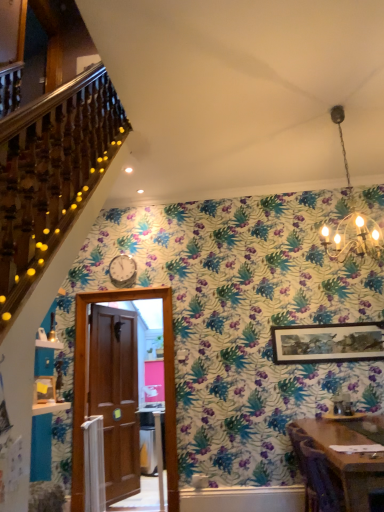
The image size is (384, 512). Describe the element at coordinates (88, 392) in the screenshot. I see `brown wooden door at center` at that location.

Measure the distance between point (341, 473) and camera.

They are 6.80 feet apart.

The height and width of the screenshot is (512, 384). Find the location of `brown wooden door at center`. brown wooden door at center is located at coordinates (88, 392).

Which point is more forward, (175, 476) or (379, 255)?

Point (379, 255)

Visually, is brown wooden door at center positioned to the left or to the right of gold chain chandelier at upper center?

Clearly, brown wooden door at center is on the left of gold chain chandelier at upper center in the image.

Is gold chain chandelier at upper center completely or partially inside brown wooden door at center?

That's incorrect, gold chain chandelier at upper center is not inside brown wooden door at center.

Considering the relative sizes of brown wooden door at center and gold chain chandelier at upper center in the image provided, is brown wooden door at center taller than gold chain chandelier at upper center?

Yes, brown wooden door at center is taller than gold chain chandelier at upper center.

Can you confirm if brown wooden door at center is bigger than wooden table at lower right?

Yes.

Is brown wooden door at center at the left side of wooden table at lower right?

Correct, you'll find brown wooden door at center to the left of wooden table at lower right.

From a real-world perspective, is brown wooden door at center above or below wooden table at lower right?

brown wooden door at center is situated higher than wooden table at lower right in the real world.

Does brown wooden door at center have a greater height compared to wooden table at lower right?

Indeed, brown wooden door at center has a greater height compared to wooden table at lower right.

Is wooden framed artwork at upper right wider or thinner than gold chain chandelier at upper center?

Considering their sizes, wooden framed artwork at upper right looks slimmer than gold chain chandelier at upper center.

In terms of size, does wooden framed artwork at upper right appear bigger or smaller than gold chain chandelier at upper center?

Clearly, wooden framed artwork at upper right is smaller in size than gold chain chandelier at upper center.

Between wooden framed artwork at upper right and gold chain chandelier at upper center, which one appears on the right side from the viewer's perspective?

Positioned to the right is wooden framed artwork at upper right.

From a real-world perspective, does wooden framed artwork at upper right sit lower than gold chain chandelier at upper center?

Indeed, from a real-world perspective, wooden framed artwork at upper right is positioned beneath gold chain chandelier at upper center.

Considering the relative sizes of gold chain chandelier at upper center and wooden framed artwork at upper right in the image provided, is gold chain chandelier at upper center taller than wooden framed artwork at upper right?

Yes.

Considering the positions of objects gold chain chandelier at upper center and wooden framed artwork at upper right in the image provided, who is more to the left, gold chain chandelier at upper center or wooden framed artwork at upper right?

From the viewer's perspective, gold chain chandelier at upper center appears more on the left side.

Can we say gold chain chandelier at upper center lies outside wooden framed artwork at upper right?

Absolutely, gold chain chandelier at upper center is external to wooden framed artwork at upper right.

Which is behind, gold chain chandelier at upper center or wooden framed artwork at upper right?

wooden framed artwork at upper right is further away from the camera.

Considering the sizes of objects wooden framed artwork at upper right and wooden table at lower right in the image provided, who is taller, wooden framed artwork at upper right or wooden table at lower right?

wooden table at lower right is taller.

Could wooden table at lower right be considered to be inside wooden framed artwork at upper right?

No, wooden table at lower right is located outside of wooden framed artwork at upper right.

Which point is more forward, (280, 355) or (332, 450)?

The point (332, 450) is closer.

Where is `picture frame that is on the right side of wooden table at lower right`? The width and height of the screenshot is (384, 512). picture frame that is on the right side of wooden table at lower right is located at coordinates (328, 343).

Is wooden table at lower right turned away from brown wooden door at center?

wooden table at lower right is not turned away from brown wooden door at center.

This screenshot has width=384, height=512. Identify the location of door above the wooden table at lower right (from a real-world perspective). (88, 392).

Consider the image. Can you confirm if wooden table at lower right is positioned to the left of brown wooden door at center?

No, wooden table at lower right is not to the left of brown wooden door at center.

Considering the sizes of objects wooden table at lower right and brown wooden door at center in the image provided, who is smaller, wooden table at lower right or brown wooden door at center?

Smaller between the two is wooden table at lower right.

Is wooden table at lower right facing towards wooden framed artwork at upper right?

No, wooden table at lower right is not aimed at wooden framed artwork at upper right.

Does wooden table at lower right have a smaller size compared to wooden framed artwork at upper right?

No, wooden table at lower right is not smaller than wooden framed artwork at upper right.

Does wooden table at lower right have a greater height compared to wooden framed artwork at upper right?

Correct, wooden table at lower right is much taller as wooden framed artwork at upper right.

Is wooden table at lower right in front of or behind wooden framed artwork at upper right in the image?

Clearly, wooden table at lower right is in front of wooden framed artwork at upper right.

Find the location of a particular element. The width and height of the screenshot is (384, 512). door that appears behind the gold chain chandelier at upper center is located at coordinates (88, 392).

This screenshot has width=384, height=512. Identify the location of table below the brown wooden door at center (from a real-world perspective). (349, 455).

When comparing their distances from brown wooden door at center, does wooden table at lower right or wooden framed artwork at upper right seem further?

Based on the image, wooden table at lower right appears to be further to brown wooden door at center.

When comparing their distances from wooden framed artwork at upper right, does gold chain chandelier at upper center or brown wooden door at center seem further?

The object further to wooden framed artwork at upper right is brown wooden door at center.

From the image, which object appears to be nearer to wooden table at lower right, gold chain chandelier at upper center or brown wooden door at center?

Among the two, gold chain chandelier at upper center is located nearer to wooden table at lower right.

Estimate the real-world distances between objects in this image. Which object is closer to brown wooden door at center, gold chain chandelier at upper center or wooden framed artwork at upper right?

wooden framed artwork at upper right is closer to brown wooden door at center.

From the image, which object appears to be farther from brown wooden door at center, wooden table at lower right or gold chain chandelier at upper center?

gold chain chandelier at upper center is positioned further to the anchor brown wooden door at center.

Based on their spatial positions, is brown wooden door at center or gold chain chandelier at upper center closer to wooden table at lower right?

gold chain chandelier at upper center is positioned closer to the anchor wooden table at lower right.

When comparing their distances from wooden framed artwork at upper right, does gold chain chandelier at upper center or wooden table at lower right seem further?

gold chain chandelier at upper center.

Considering their positions, is wooden framed artwork at upper right positioned closer to gold chain chandelier at upper center than brown wooden door at center?

wooden framed artwork at upper right.

At what (x,y) coordinates should I click in order to perform the action: click on light fixture between brown wooden door at center and wooden framed artwork at upper right in the horizontal direction. Please return your answer as a coordinate pair (x, y). Looking at the image, I should click on (353, 214).

Identify the location of door between gold chain chandelier at upper center and wooden table at lower right from top to bottom. (88, 392).

Find the location of a particular element. The width and height of the screenshot is (384, 512). table between brown wooden door at center and wooden framed artwork at upper right is located at coordinates (349, 455).

This screenshot has width=384, height=512. I want to click on picture frame between gold chain chandelier at upper center and wooden table at lower right in the vertical direction, so click(328, 343).